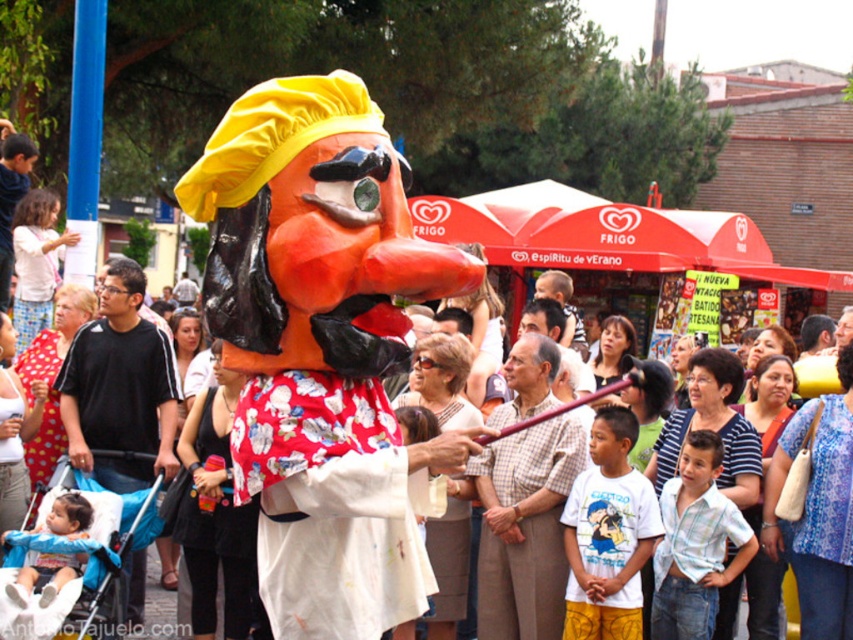
You are a costume designer preparing to pack two items from the scene into a storage box. The printed fabric cape at center and the matte black shirt at left must both be placed inside. Given that the box can only accommodate one large item, which item should you prioritize placing first to ensure both fit?

The printed fabric cape at center is bigger than matte black shirt at left, so you should prioritize placing the printed fabric cape at center first to ensure both items fit into the box.

You are organizing a charity event and need to display two shirts for a raffle. The shirts are the black cotton shirt at center and the matte black shirt at left. Which shirt should you choose if you want to display a larger one?

The black cotton shirt at center is bigger than the matte black shirt at left, so you should choose the black cotton shirt at center for display.